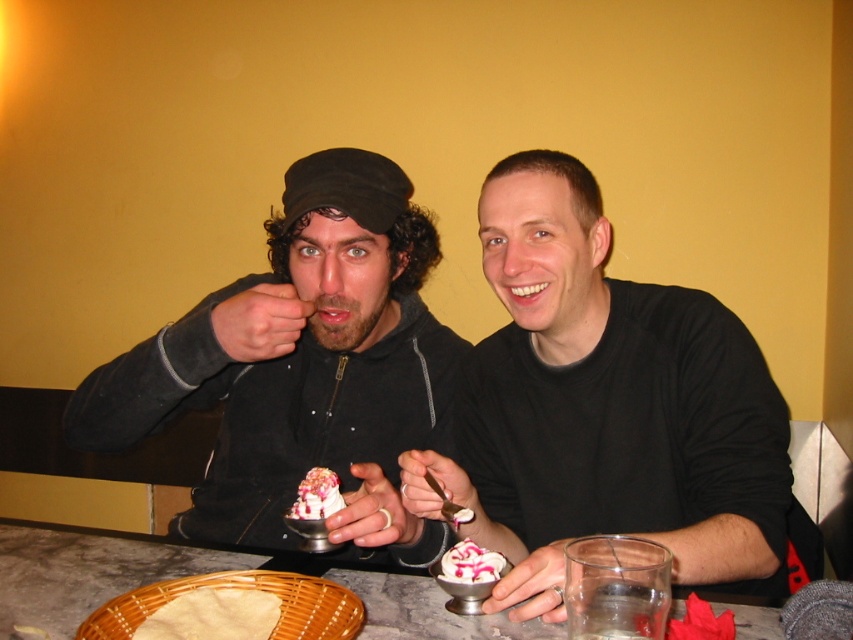
Can you confirm if black matte shirt at center is thinner than white creamy dessert at center?

No, black matte shirt at center is not thinner than white creamy dessert at center.

Between black matte shirt at center and white creamy dessert at center, which one has less height?

white creamy dessert at center

You are a GUI agent. You are given a task and a screenshot of the screen. Output one action in this format:
    pyautogui.click(x=<x>, y=<y>)
    Task: Click on the black matte shirt at center
    This screenshot has height=640, width=853.
    Given the screenshot: What is the action you would take?
    pyautogui.click(x=605, y=406)

Where is `black matte shirt at center`? Image resolution: width=853 pixels, height=640 pixels. black matte shirt at center is located at coordinates (605, 406).

Does black matte shirt at center have a smaller size compared to matte yellow bread at lower left?

No.

Which is in front, point (404, 499) or point (260, 612)?

Positioned in front is point (260, 612).

What do you see at coordinates (605, 406) in the screenshot?
I see `black matte shirt at center` at bounding box center [605, 406].

The image size is (853, 640). Identify the location of black matte shirt at center. pyautogui.click(x=605, y=406).

Can you confirm if marble table at center is positioned to the right of whipped cream at center?

In fact, marble table at center is to the left of whipped cream at center.

Between marble table at center and whipped cream at center, which one appears on the left side from the viewer's perspective?

From the viewer's perspective, marble table at center appears more on the left side.

At what (x,y) coordinates should I click in order to perform the action: click on marble table at center. Please return your answer as a coordinate pair (x, y). Image resolution: width=853 pixels, height=640 pixels. Looking at the image, I should click on (86, 572).

The image size is (853, 640). I want to click on marble table at center, so click(x=86, y=572).